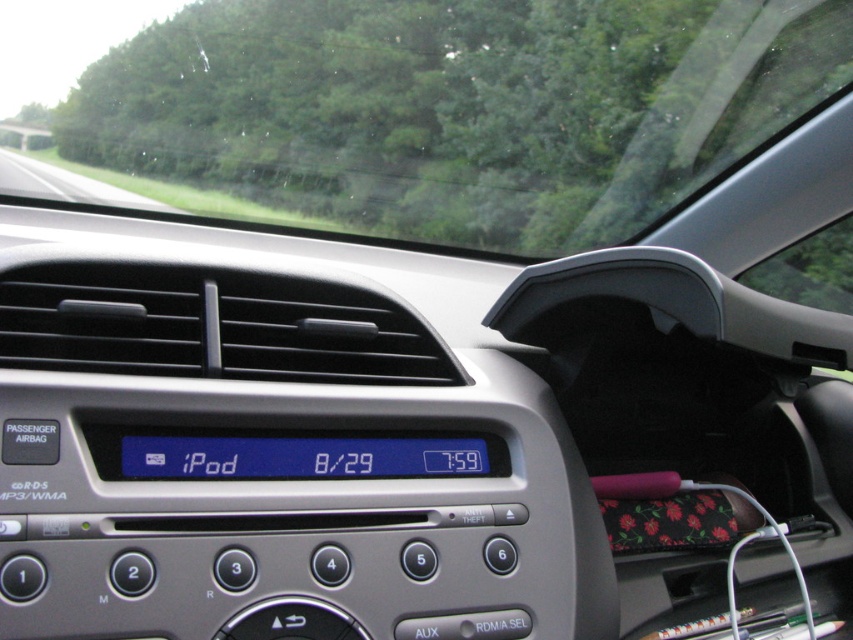
You are sitting in the driver seat of the car. You see the transparent glass windshield at upper center and the blue lcd display at center. Which object is located higher in the car?

The transparent glass windshield at upper center is located higher than the blue lcd display at center.

You are driving a car and looking at the dashboard. You see the transparent glass windshield at upper center and the blue lcd display at center. Which object is positioned to the left?

The transparent glass windshield at upper center is to the left of the blue lcd display at center.